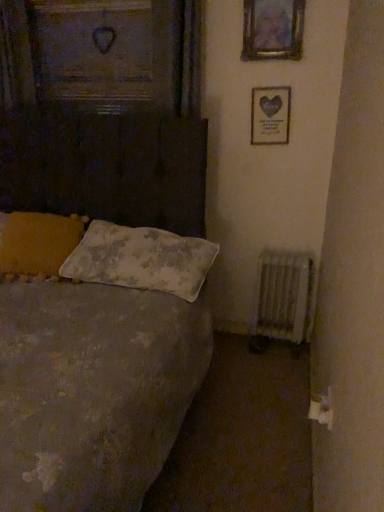
Question: Would you say metallic silver picture frame at upper center, the first picture frame in the top-to-bottom sequence, is outside matte silver picture frame at upper right, the 2th picture frame in the front-to-back sequence?

Choices:
 (A) yes
 (B) no

Answer: (A)

Question: Is metallic silver picture frame at upper center, arranged as the second picture frame when ordered from the bottom, at the left side of matte silver picture frame at upper right, the 2th picture frame in the front-to-back sequence?

Choices:
 (A) no
 (B) yes

Answer: (B)

Question: From the image's perspective, is metallic silver picture frame at upper center, arranged as the second picture frame when ordered from the bottom, over matte silver picture frame at upper right, which is counted as the second picture frame, starting from the top?

Choices:
 (A) yes
 (B) no

Answer: (A)

Question: Is metallic silver picture frame at upper center, marked as the second picture frame in a back-to-front arrangement, oriented towards matte silver picture frame at upper right, which appears as the 1th picture frame when viewed from the back?

Choices:
 (A) no
 (B) yes

Answer: (A)

Question: Can you confirm if metallic silver picture frame at upper center, the first picture frame in the top-to-bottom sequence, is smaller than matte silver picture frame at upper right, which appears as the 1th picture frame when viewed from the back?

Choices:
 (A) no
 (B) yes

Answer: (A)

Question: Is metallic silver picture frame at upper center, the first picture frame from the front, inside or outside of matte silver picture frame at upper right, the 2th picture frame in the front-to-back sequence?

Choices:
 (A) inside
 (B) outside

Answer: (B)

Question: Considering the positions of metallic silver picture frame at upper center, the first picture frame in the top-to-bottom sequence, and matte silver picture frame at upper right, which is counted as the first picture frame, starting from the bottom, in the image, is metallic silver picture frame at upper center, the first picture frame in the top-to-bottom sequence, bigger or smaller than matte silver picture frame at upper right, which is counted as the first picture frame, starting from the bottom,?

Choices:
 (A) big
 (B) small

Answer: (A)

Question: Is metallic silver picture frame at upper center, the first picture frame from the front, wider or thinner than matte silver picture frame at upper right, which is counted as the first picture frame, starting from the bottom?

Choices:
 (A) wide
 (B) thin

Answer: (A)

Question: Relative to matte silver picture frame at upper right, which is counted as the first picture frame, starting from the bottom, is metallic silver picture frame at upper center, the first picture frame from the front, in front or behind?

Choices:
 (A) front
 (B) behind

Answer: (A)

Question: From a real-world perspective, is textured gray bed at left positioned above or below white textured pillow at center, which is the 2th pillow from left to right?

Choices:
 (A) below
 (B) above

Answer: (B)

Question: From the image's perspective, is textured gray bed at left positioned above or below white textured pillow at center, which is the 2th pillow from left to right?

Choices:
 (A) below
 (B) above

Answer: (A)

Question: Relative to white textured pillow at center, arranged as the 1th pillow when viewed from the right, is textured gray bed at left in front or behind?

Choices:
 (A) front
 (B) behind

Answer: (A)

Question: Is textured gray bed at left inside or outside of white textured pillow at center, which is the 2th pillow from left to right?

Choices:
 (A) inside
 (B) outside

Answer: (B)

Question: Based on their sizes in the image, would you say matte silver picture frame at upper right, the 2th picture frame in the front-to-back sequence, is bigger or smaller than white textured radiator at lower right?

Choices:
 (A) small
 (B) big

Answer: (A)

Question: Would you say matte silver picture frame at upper right, the 2th picture frame in the front-to-back sequence, is inside or outside white textured radiator at lower right?

Choices:
 (A) outside
 (B) inside

Answer: (A)